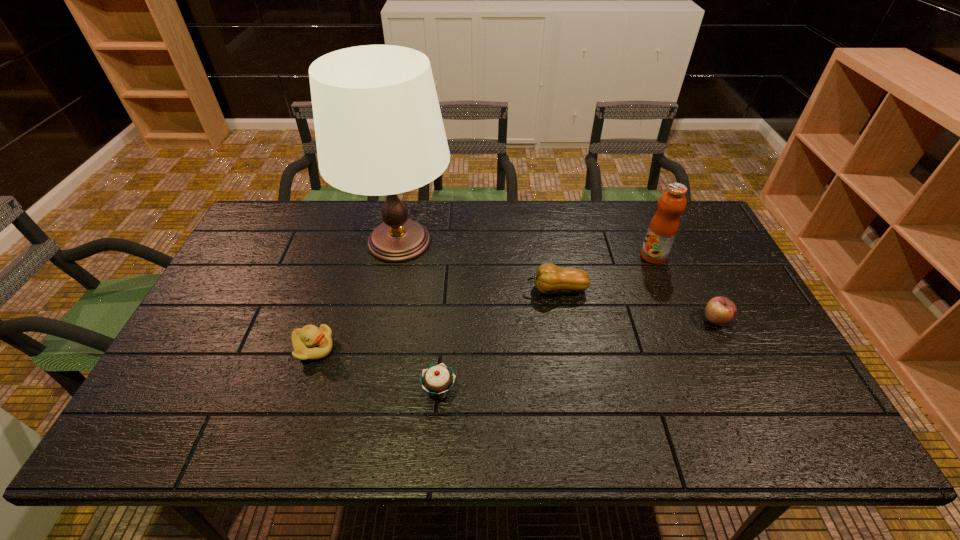
Identify the location of empty location between the duckling and the fifth shortest object. This screenshot has width=960, height=540. (484, 302).

At what (x,y) coordinates should I click in order to perform the action: click on blank region between the fifth shortest object and the duckling. Please return your answer as a coordinate pair (x, y). The image size is (960, 540). Looking at the image, I should click on (484, 302).

Find the location of a particular element. The height and width of the screenshot is (540, 960). free space between the cupcake and the gourd is located at coordinates (498, 340).

Identify the location of blank region between the third object from right to left and the lamp. This screenshot has height=540, width=960. (478, 266).

Where is `vacant space that's between the lamp and the fifth farthest object`? vacant space that's between the lamp and the fifth farthest object is located at coordinates (356, 295).

At what (x,y) coordinates should I click in order to perform the action: click on unoccupied position between the second object from right to left and the gourd. Please return your answer as a coordinate pair (x, y). Looking at the image, I should click on (605, 273).

Locate an element on the screen. object that stands as the fourth closest to the fifth shortest object is located at coordinates (438, 379).

Select which object is the closest to the apple. Please provide its 2D coordinates. Your answer should be formatted as a tuple, i.e. [(x, y)], where the tuple contains the x and y coordinates of a point satisfying the conditions above.

[(664, 225)]

Where is `vacant space that satisfies the following two spatial constraints: 1. on the stem side of the fourth object from left to right; 2. on the left side of the apple`? The width and height of the screenshot is (960, 540). vacant space that satisfies the following two spatial constraints: 1. on the stem side of the fourth object from left to right; 2. on the left side of the apple is located at coordinates (562, 321).

Image resolution: width=960 pixels, height=540 pixels. I want to click on vacant region that satisfies the following two spatial constraints: 1. on the front label of the apple; 2. on the right side of the second tallest object, so click(680, 321).